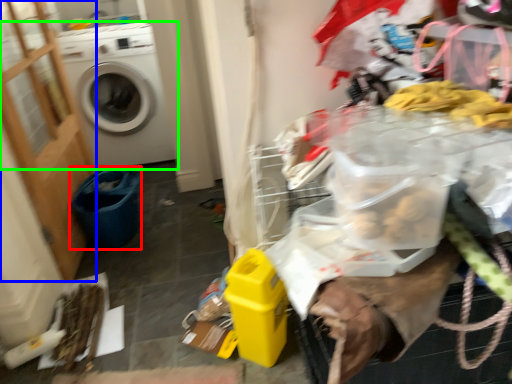
Question: Which is nearer to the recycling bin (highlighted by a red box)? screen door (highlighted by a blue box) or washing machine (highlighted by a green box).

Choices:
 (A) screen door
 (B) washing machine

Answer: (A)